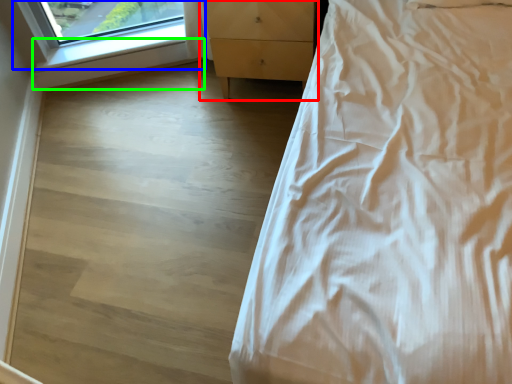
Question: Which object is the farthest from chest of drawers (highlighted by a red box)? Choose among these: window (highlighted by a blue box) or window sill (highlighted by a green box).

Choices:
 (A) window
 (B) window sill

Answer: (B)